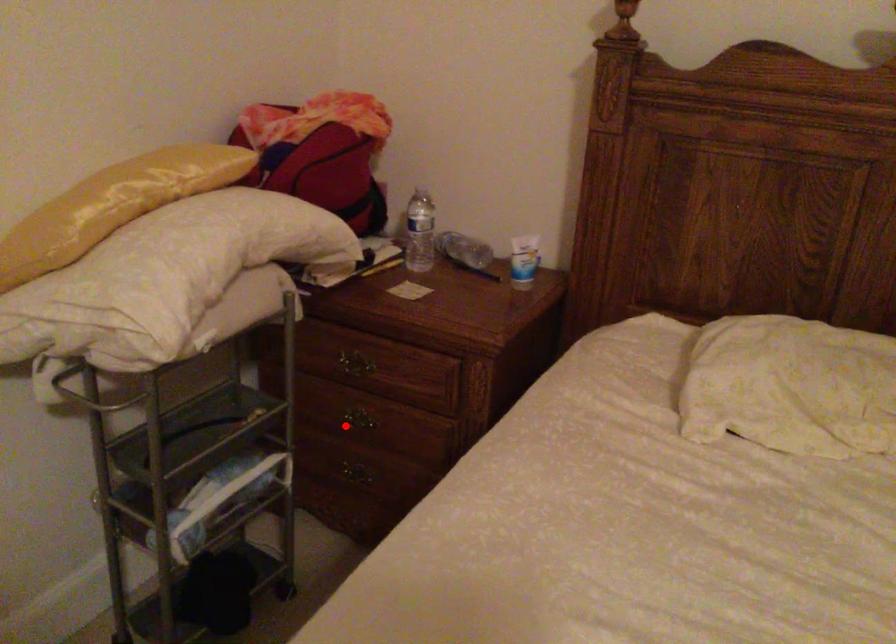
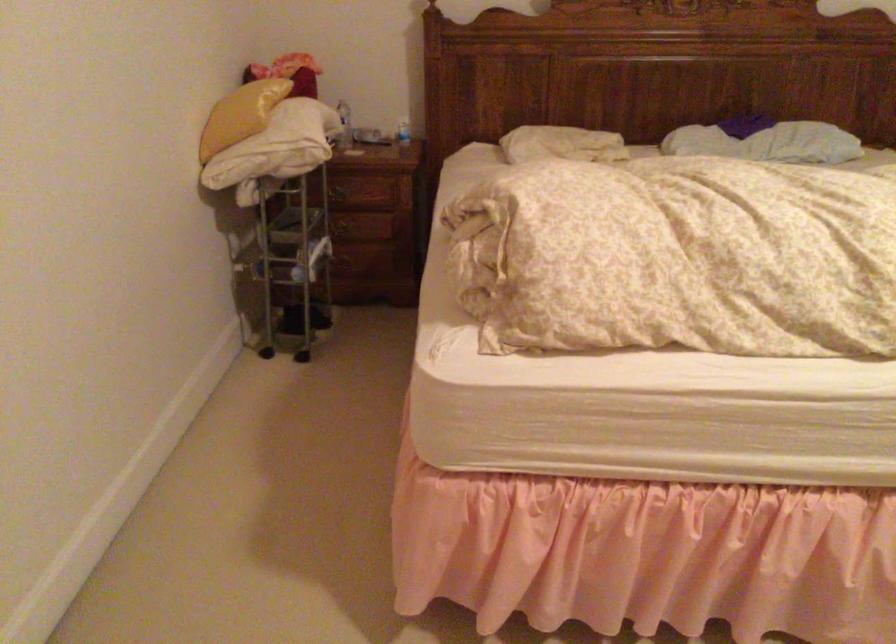
Question: I am providing you with two images of the same scene from different viewpoints. Given a red point in image1, look at the same physical point in image2. Is it:

Choices:
 (A) Closer to the viewpoint
 (B) Farther from the viewpoint

Answer: (B)